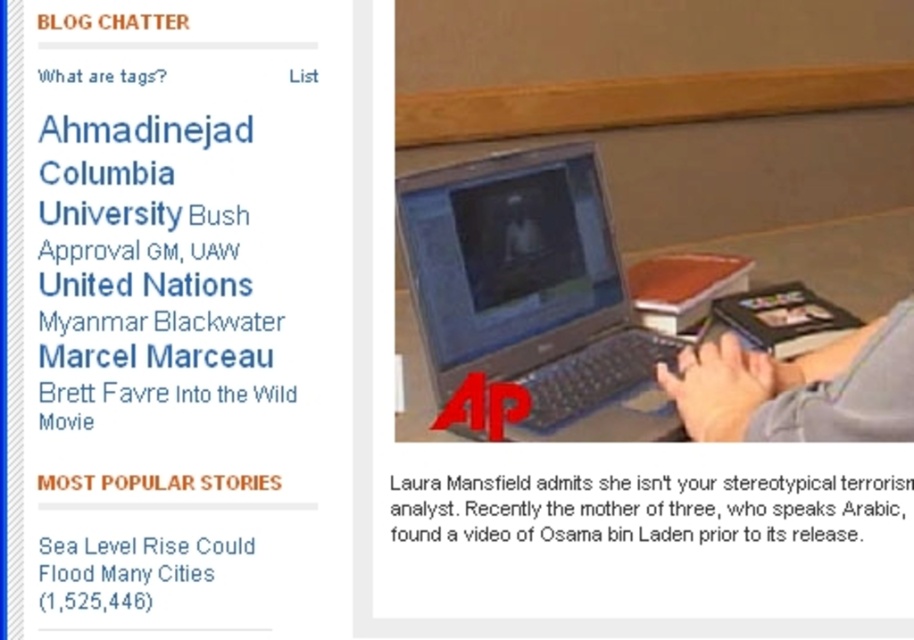
Question: Considering the relative positions of matte plastic laptop at center and white paper at lower center in the image provided, where is matte plastic laptop at center located with respect to white paper at lower center?

Choices:
 (A) below
 (B) above

Answer: (B)

Question: Which object is closer to the camera taking this photo?

Choices:
 (A) white paper at lower center
 (B) matte plastic laptop at center

Answer: (A)

Question: Which object is the closest to the matte plastic laptop at center?

Choices:
 (A) white paper at lower center
 (B) white text on black background at upper left

Answer: (A)

Question: Which of the following is the farthest from the observer?

Choices:
 (A) (227, 548)
 (B) (462, 200)
 (C) (583, 508)

Answer: (B)

Question: Does matte plastic laptop at center appear under white text on black background at upper left?

Choices:
 (A) no
 (B) yes

Answer: (A)

Question: Does matte plastic laptop at center appear over white paper at lower center?

Choices:
 (A) no
 (B) yes

Answer: (B)